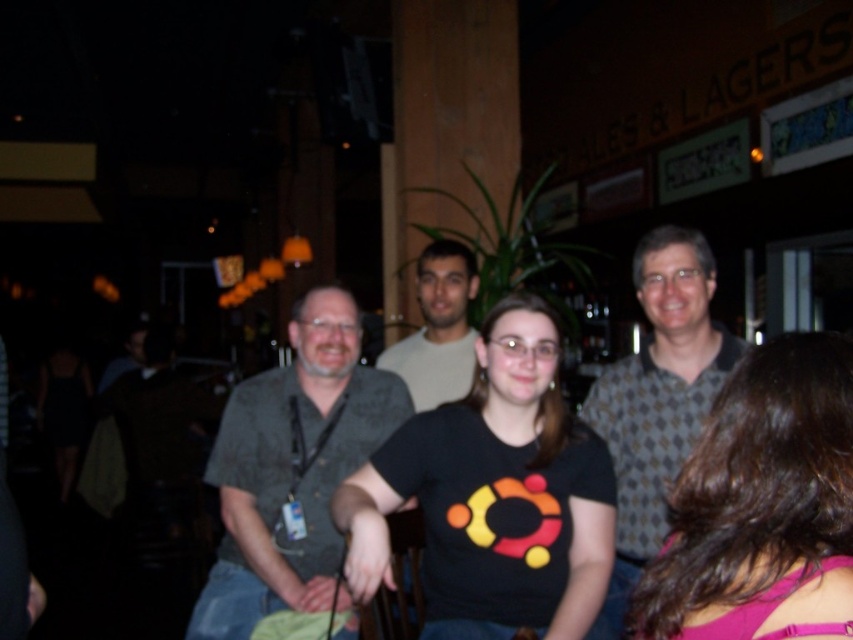
Is dark green textured shirt at center shorter than patterned fabric shirt at center?

No, dark green textured shirt at center is not shorter than patterned fabric shirt at center.

Where is `dark green textured shirt at center`? The image size is (853, 640). dark green textured shirt at center is located at coordinates (292, 468).

Between point (228, 513) and point (633, 536), which one is positioned behind?

The point (228, 513) is behind.

I want to click on dark green textured shirt at center, so click(292, 468).

Which is behind, point (538, 516) or point (447, 268)?

Point (447, 268)

Is black matte t-shirt at center shorter than light beige shirt at center?

Incorrect, black matte t-shirt at center's height does not fall short of light beige shirt at center's.

Describe the element at coordinates (494, 493) in the screenshot. The image size is (853, 640). I see `black matte t-shirt at center` at that location.

The height and width of the screenshot is (640, 853). I want to click on black matte t-shirt at center, so click(x=494, y=493).

Looking at this image, can you confirm if dark brown hair at center is smaller than light beige shirt at center?

Yes, dark brown hair at center is smaller than light beige shirt at center.

You are a GUI agent. You are given a task and a screenshot of the screen. Output one action in this format:
    pyautogui.click(x=<x>, y=<y>)
    Task: Click on the dark brown hair at center
    Image resolution: width=853 pixels, height=640 pixels.
    Given the screenshot: What is the action you would take?
    pyautogui.click(x=762, y=506)

Is point (840, 602) closer to camera compared to point (380, 362)?

Yes, point (840, 602) is closer to viewer.

Where is `dark brown hair at center`? The image size is (853, 640). dark brown hair at center is located at coordinates (762, 506).